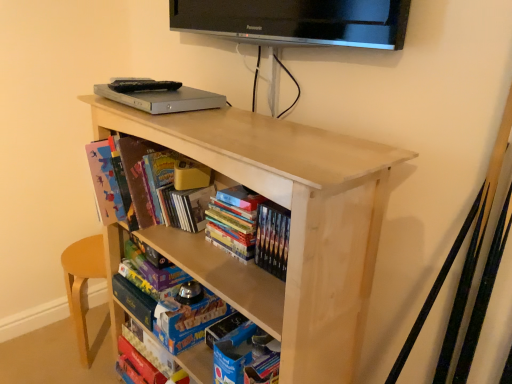
Question: From a real-world perspective, relative to natural wood shelf at center, is hardcover books at center, which is the second book from bottom to top, vertically above or below?

Choices:
 (A) below
 (B) above

Answer: (B)

Question: In terms of height, does hardcover books at center, arranged as the third book when viewed from the top, look taller or shorter compared to natural wood shelf at center?

Choices:
 (A) short
 (B) tall

Answer: (A)

Question: Which of these objects is positioned closest to the natural wood shelf at center?

Choices:
 (A) matte cardboard book at upper left, the first book when ordered from top to bottom
 (B) blue cardboard book at lower center
 (C) hardcover books at center, arranged as the third book when viewed from the top
 (D) hardcover book at center, acting as the 3th book starting from the bottom
 (E) matte cardboard book at lower center, which is the fourth book in top-to-bottom order

Answer: (C)

Question: Which is farther from the hardcover books at center, arranged as the third book when viewed from the top?

Choices:
 (A) matte cardboard book at upper left, the first book when ordered from top to bottom
 (B) hardcover book at center, the second book positioned from the top
 (C) matte cardboard book at lower center, which is the fourth book in top-to-bottom order
 (D) natural wood shelf at center
 (E) blue cardboard book at lower center

Answer: (C)